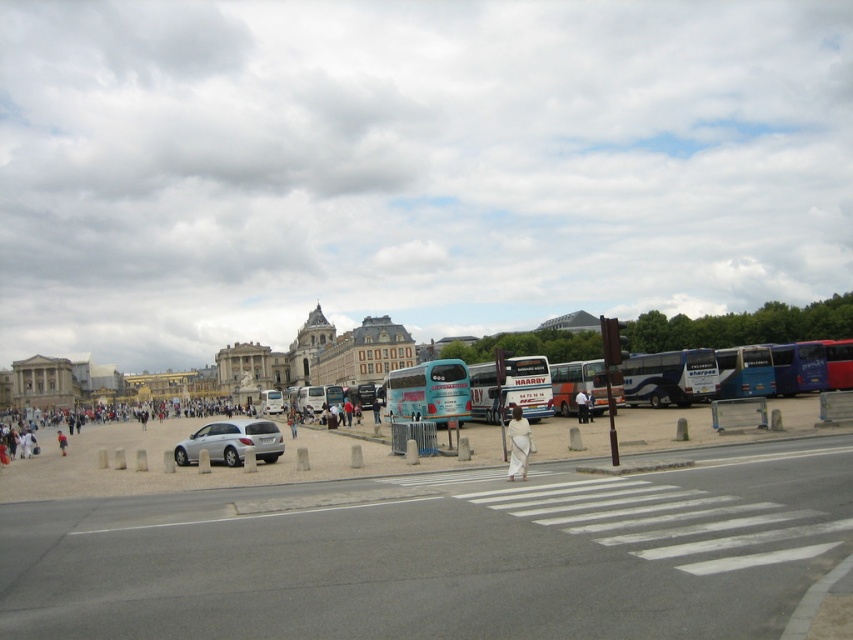
Is blue metallic tour bus at center to the left of white cloth at center from the viewer's perspective?

No, blue metallic tour bus at center is not to the left of white cloth at center.

Who is more forward, (677, 378) or (514, 461)?

Point (514, 461) is more forward.

Does point (622, 378) lie behind point (514, 436)?

Yes, point (622, 378) is behind point (514, 436).

Locate an element on the screen. Image resolution: width=853 pixels, height=640 pixels. blue metallic tour bus at center is located at coordinates (670, 378).

Consider the image. Does concrete plaza at center appear under blue metallic tour bus at center?

Correct, concrete plaza at center is located below blue metallic tour bus at center.

Who is more distant from viewer, (183, 500) or (686, 385)?

Point (686, 385)

Locate an element on the screen. The height and width of the screenshot is (640, 853). concrete plaza at center is located at coordinates (433, 540).

Between teal matte double-decker bus at center and white cloth at center, which one appears on the left side from the viewer's perspective?

teal matte double-decker bus at center

Is point (416, 392) farther from camera compared to point (514, 413)?

Yes, it is.

Between point (462, 416) and point (509, 476), which one is positioned behind?

Positioned behind is point (462, 416).

Locate an element on the screen. The width and height of the screenshot is (853, 640). teal matte double-decker bus at center is located at coordinates (428, 392).